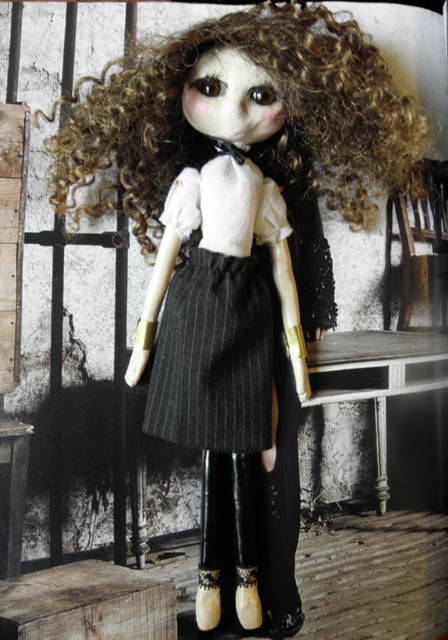
Question: Can you confirm if curly blonde hair at center is thinner than dark gray pinstriped skirt at center?

Choices:
 (A) yes
 (B) no

Answer: (B)

Question: Is curly blonde hair at center closer to camera compared to dark gray pinstriped skirt at center?

Choices:
 (A) no
 (B) yes

Answer: (B)

Question: Which point appears farthest from the camera in this image?

Choices:
 (A) (179, 340)
 (B) (116, 106)

Answer: (A)

Question: Is curly blonde hair at center above dark gray pinstriped skirt at center?

Choices:
 (A) no
 (B) yes

Answer: (B)